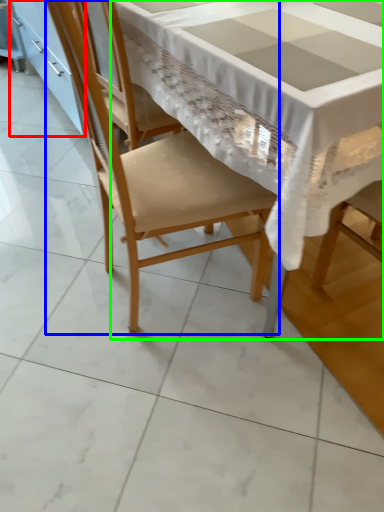
Question: Estimate the real-world distances between objects in this image. Which object is closer to cabinetry (highlighted by a red box), chair (highlighted by a blue box) or table (highlighted by a green box)?

Choices:
 (A) chair
 (B) table

Answer: (A)